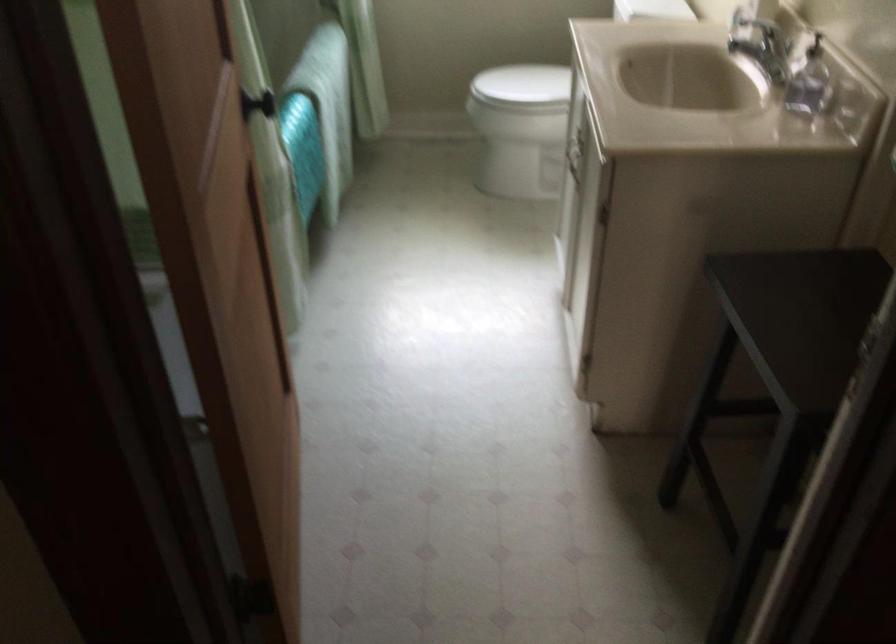
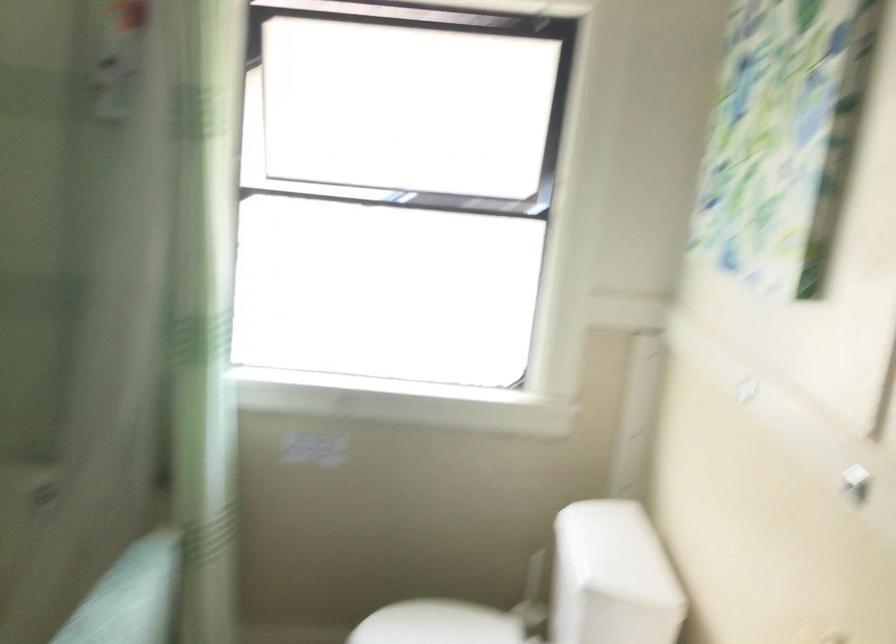
Question: Which direction would the cameraman need to move to produce the second image? Reply with the corresponding letter.

Choices:
 (A) Left
 (B) Right
 (C) Forward
 (D) Backward

Answer: (C)